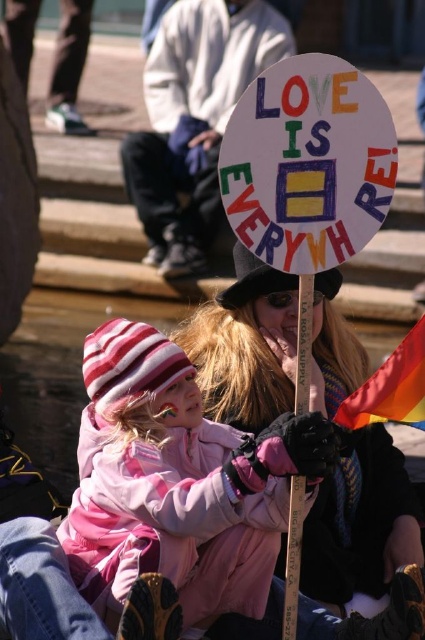
Can you confirm if hand-drawn paper sign at center is positioned to the right of wooden signpost at center?

Yes, hand-drawn paper sign at center is to the right of wooden signpost at center.

Based on the photo, is hand-drawn paper sign at center bigger than wooden signpost at center?

Actually, hand-drawn paper sign at center might be smaller than wooden signpost at center.

Does point (254, 250) come in front of point (294, 576)?

Yes, it is in front of point (294, 576).

The width and height of the screenshot is (425, 640). What are the coordinates of `hand-drawn paper sign at center` in the screenshot? It's located at (308, 163).

Who is more distant from viewer, [175,531] or [300,280]?

Positioned behind is point [175,531].

Looking at this image, is pink fleece jacket at center further to camera compared to wooden signpost at center?

No, pink fleece jacket at center is closer to the viewer.

The width and height of the screenshot is (425, 640). Describe the element at coordinates (178, 483) in the screenshot. I see `pink fleece jacket at center` at that location.

Locate an element on the screen. The height and width of the screenshot is (640, 425). pink fleece jacket at center is located at coordinates (178, 483).

Between matte black hat at center and hand-drawn paper sign at center, which one is positioned lower?

matte black hat at center is below.

Who is more forward, (238,428) or (354,234)?

Positioned in front is point (354,234).

Who is more distant from viewer, [320,387] or [350,100]?

The point [320,387] is more distant.

Where is `matte black hat at center`? The height and width of the screenshot is (640, 425). matte black hat at center is located at coordinates (360, 524).